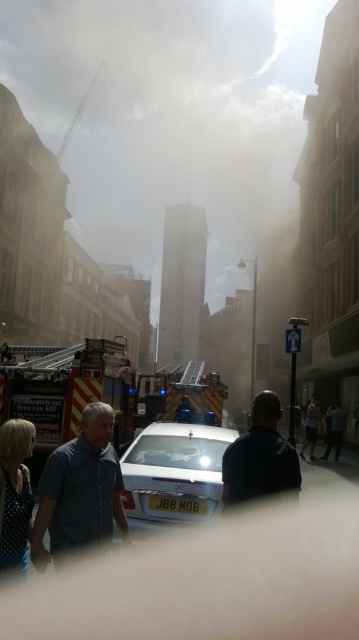
Can you confirm if blue denim shirt at center is positioned to the right of white glossy car at center?

Incorrect, blue denim shirt at center is not on the right side of white glossy car at center.

Where is `blue denim shirt at center`? The image size is (359, 640). blue denim shirt at center is located at coordinates (80, 490).

Where is `blue denim shirt at center`? Image resolution: width=359 pixels, height=640 pixels. blue denim shirt at center is located at coordinates (80, 490).

Between white glossy car at center and dark blue shirt at center, which one is positioned higher?

dark blue shirt at center is higher up.

Who is shorter, white glossy car at center or dark blue shirt at center?

With less height is white glossy car at center.

Is point (188, 509) farther from camera compared to point (273, 417)?

Yes, it is behind point (273, 417).

At what (x,y) coordinates should I click in order to perform the action: click on white glossy car at center. Please return your answer as a coordinate pair (x, y). The image size is (359, 640). Looking at the image, I should click on (174, 474).

Is yellow reflective fire truck at left positioned at the back of dark blue jeans at center?

No.

Is point (12, 394) less distant than point (311, 432)?

Yes, it is in front of point (311, 432).

What do you see at coordinates (72, 390) in the screenshot?
I see `yellow reflective fire truck at left` at bounding box center [72, 390].

This screenshot has height=640, width=359. Identify the location of yellow reflective fire truck at left. (72, 390).